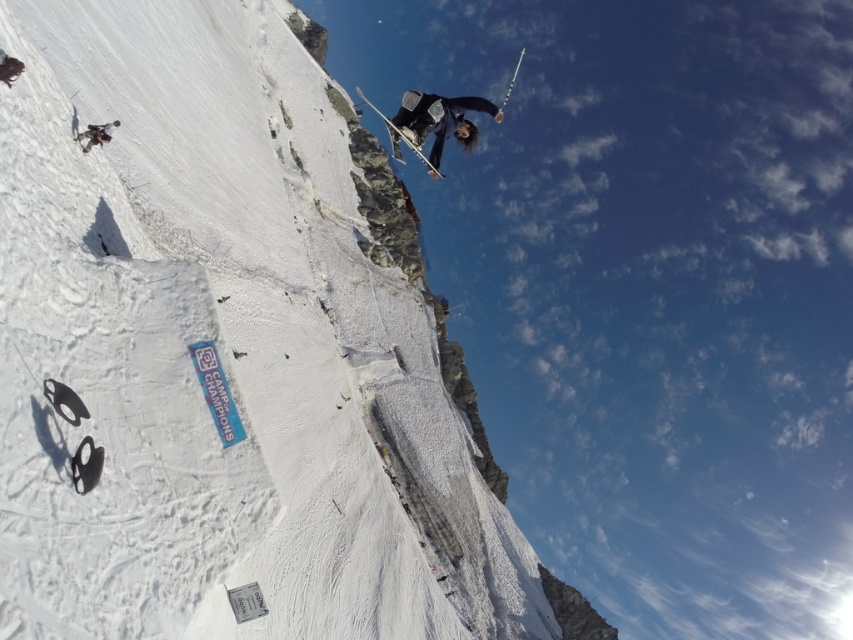
Is dark blue fabric skier at upper center bigger than matte black snowboarder at upper left?

Correct, dark blue fabric skier at upper center is larger in size than matte black snowboarder at upper left.

Can you confirm if dark blue fabric skier at upper center is positioned below matte black snowboarder at upper left?

No, dark blue fabric skier at upper center is not below matte black snowboarder at upper left.

This screenshot has width=853, height=640. What do you see at coordinates (440, 120) in the screenshot?
I see `dark blue fabric skier at upper center` at bounding box center [440, 120].

At what (x,y) coordinates should I click in order to perform the action: click on dark blue fabric skier at upper center. Please return your answer as a coordinate pair (x, y). Looking at the image, I should click on (440, 120).

Describe the element at coordinates (399, 132) in the screenshot. I see `shiny metallic ski at center` at that location.

Measure the distance between point (389,124) and camera.

Point (389,124) is 62.81 meters away from camera.

You are a GUI agent. You are given a task and a screenshot of the screen. Output one action in this format:
    pyautogui.click(x=<x>, y=<y>)
    Task: Click on the shiny metallic ski at center
    Image resolution: width=853 pixels, height=640 pixels.
    Given the screenshot: What is the action you would take?
    pyautogui.click(x=399, y=132)

Who is more distant from viewer, (x=117, y=28) or (x=413, y=141)?

The point (x=117, y=28) is behind.

Which is in front, point (178, 484) or point (393, 152)?

Point (178, 484) is more forward.

Locate an element on the screen. white snow cliff at upper center is located at coordinates (219, 353).